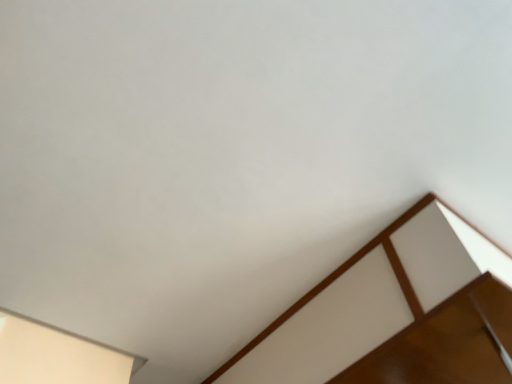
You are a GUI agent. You are given a task and a screenshot of the screen. Output one action in this format:
    pyautogui.click(x=<x>, y=<y>)
    Task: Click on the wooden paneling at lower right
    This screenshot has width=512, height=384.
    Given the screenshot: What is the action you would take?
    pyautogui.click(x=395, y=313)

This screenshot has height=384, width=512. What do you see at coordinates (395, 313) in the screenshot? I see `wooden paneling at lower right` at bounding box center [395, 313].

I want to click on wooden paneling at lower right, so click(395, 313).